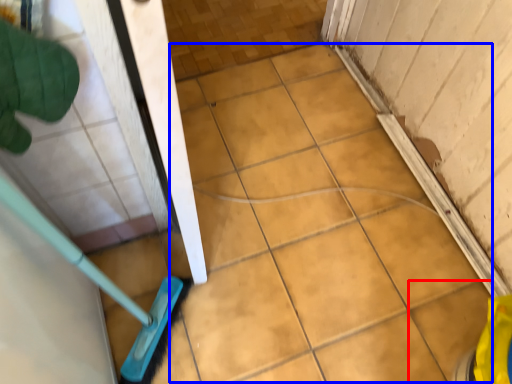
Question: Which object appears closest to the camera in this image, ceramic tile (highlighted by a red box) or ceramic tile (highlighted by a blue box)?

Choices:
 (A) ceramic tile
 (B) ceramic tile

Answer: (A)